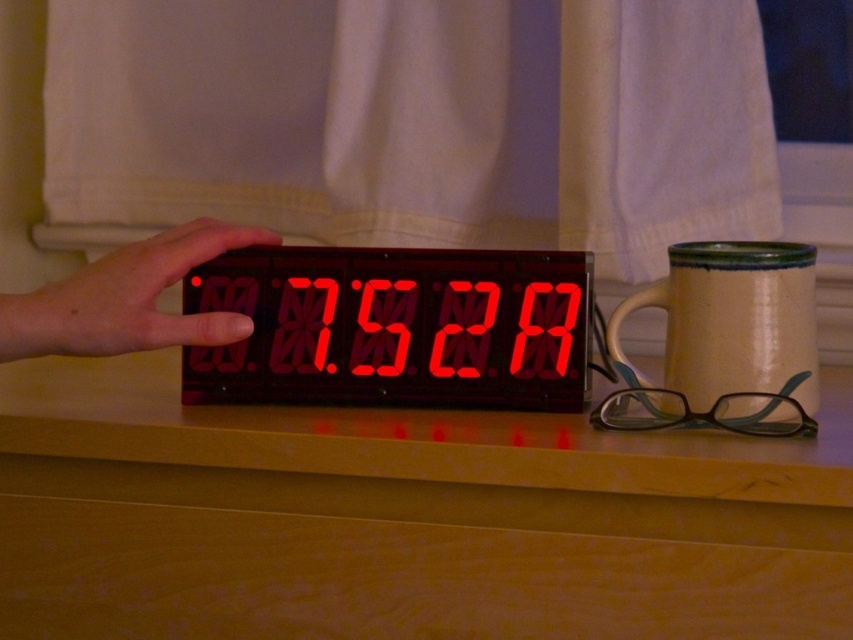
Question: Is wooden table at center to the left of red led display at center from the viewer's perspective?

Choices:
 (A) no
 (B) yes

Answer: (A)

Question: Estimate the real-world distances between objects in this image. Which object is farther from the red led display at center?

Choices:
 (A) wooden table at center
 (B) matte ceramic mug at right
 (C) matte black hand at center

Answer: (B)

Question: Among these points, which one is farthest from the camera?

Choices:
 (A) (444, 388)
 (B) (73, 344)
 (C) (727, 268)

Answer: (A)

Question: Which point is farther to the camera?

Choices:
 (A) (180, 321)
 (B) (273, 273)

Answer: (B)

Question: Observing the image, what is the correct spatial positioning of red led display at center in reference to matte black hand at center?

Choices:
 (A) right
 (B) left

Answer: (A)

Question: Can you confirm if matte ceramic mug at right is positioned below matte black hand at center?

Choices:
 (A) no
 (B) yes

Answer: (B)